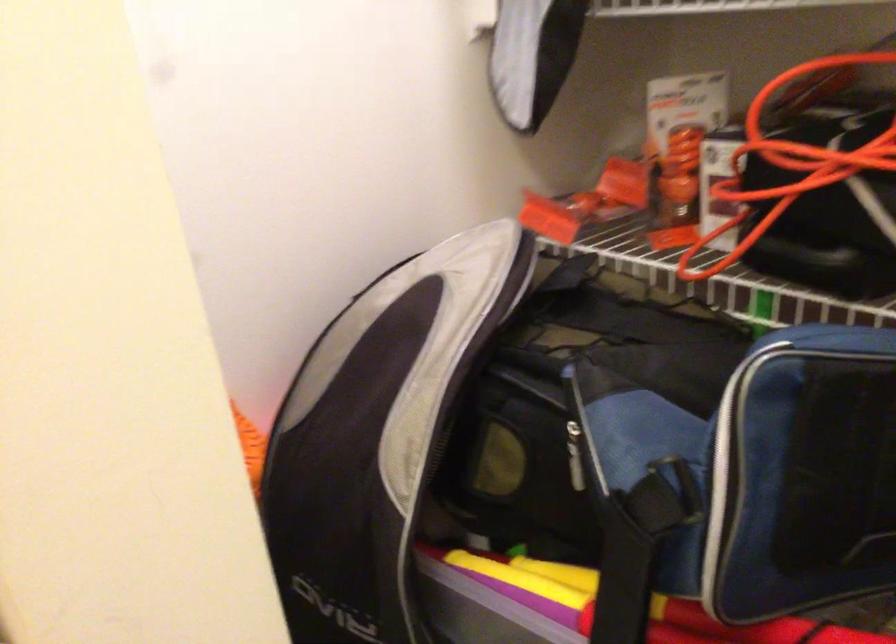
Find where to lift the black bag strap. Please return your answer as a coordinate pair (x, y).

(622, 581)